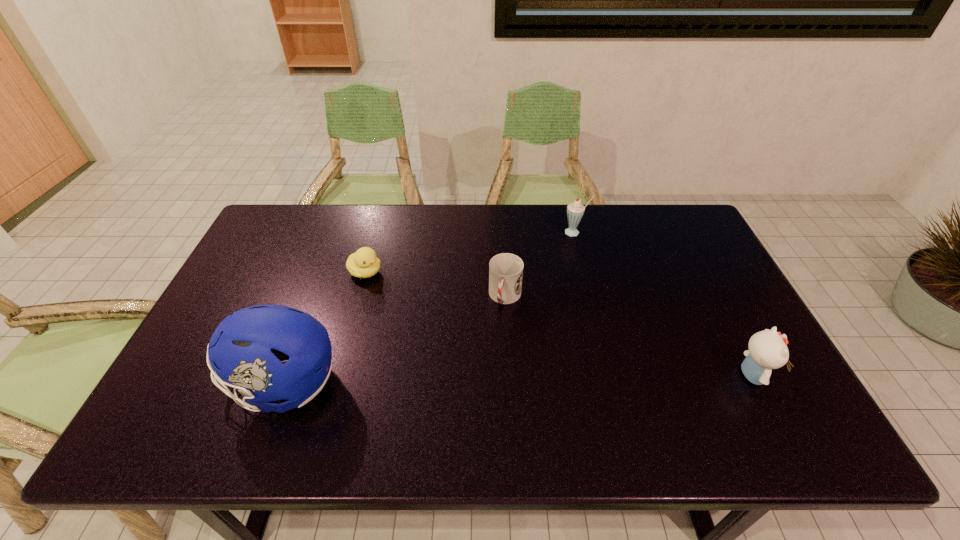
I want to click on vacant space on the desktop that is between the football helmet and the kitten and is positioned on the handle side of the third object from left to right, so click(x=480, y=381).

Locate an element on the screen. The width and height of the screenshot is (960, 540). free space on the desktop that is between the football helmet and the kitten and is positioned at the beak of the duckling is located at coordinates (550, 379).

The width and height of the screenshot is (960, 540). I want to click on vacant spot on the desktop that is between the tallest object and the rightmost object and is positioned on the straw side of the milkshake, so click(470, 381).